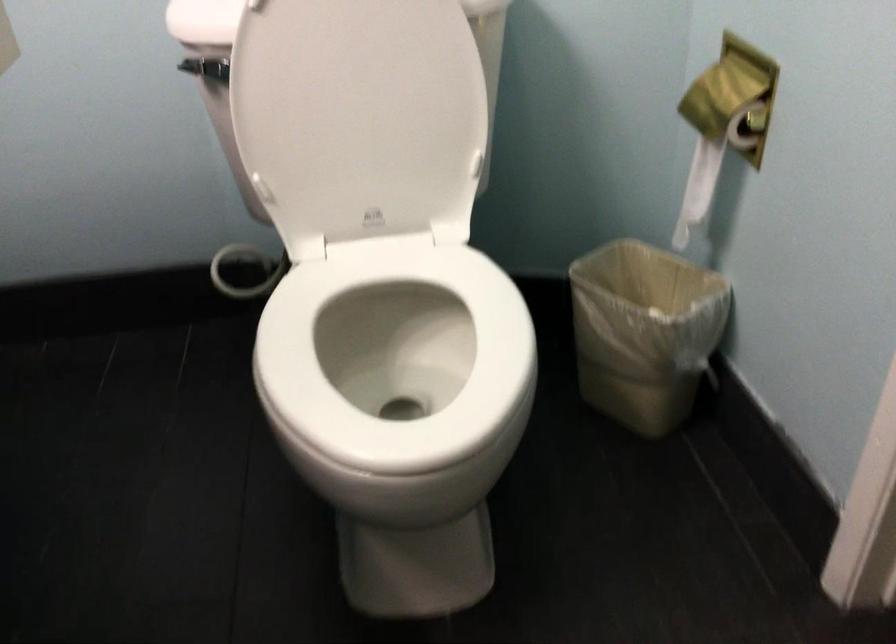
Find where to push the toilet flush handle. Please return your answer as a coordinate pair (x, y).

(192, 69)